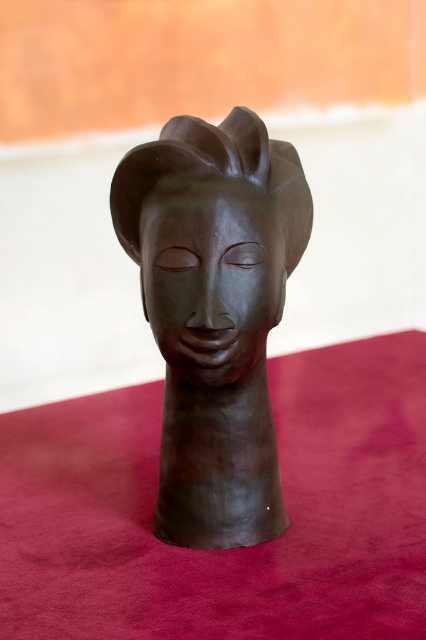
You are an art conservator checking the spacing between two sculptures in a museum display. The museum requires at least 1.5 inches between displayed items for safety. Are the matte bronze head at center and the matte black face at center spaced properly according to the requirement?

The matte bronze head at center is only 1.33 inches from the matte black face at center, which is less than the required 1.5 inches. Therefore, the spacing between the matte bronze head at center and the matte black face at center does not meet the museum safety requirement.

You are an art conservator examining the sculpture. Which object is closer to you, the matte bronze head at center or the matte black face at center?

The matte bronze head at center is closer to you than the matte black face at center.